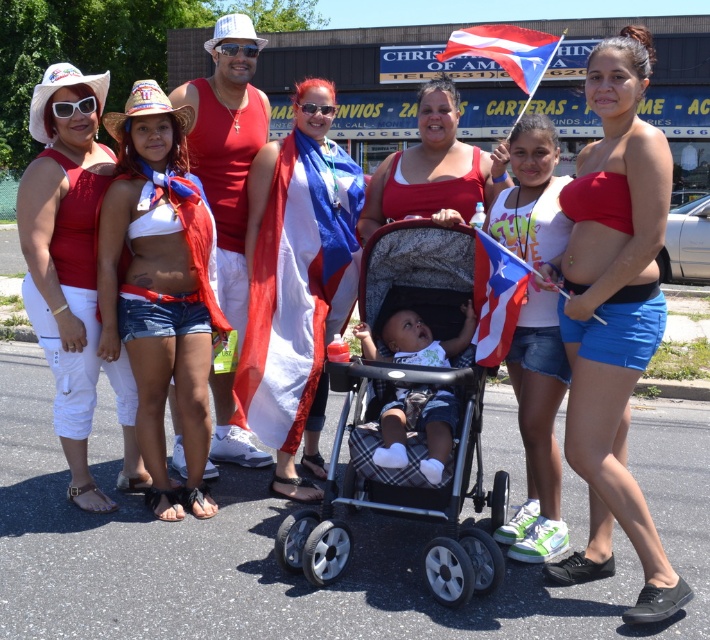
What are the coordinates of the black plastic baby carriage at center?

The coordinates of the black plastic baby carriage at center are at point (403, 484).